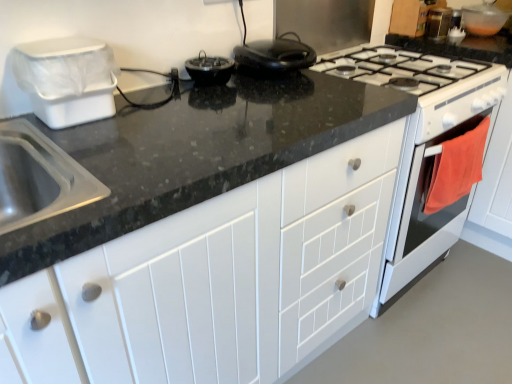
Where is `vacant area that lies in front of metallic silver toaster at upper right, marked as the 2th appliance in a front-to-back arrangement`? This screenshot has height=384, width=512. vacant area that lies in front of metallic silver toaster at upper right, marked as the 2th appliance in a front-to-back arrangement is located at coordinates [452, 41].